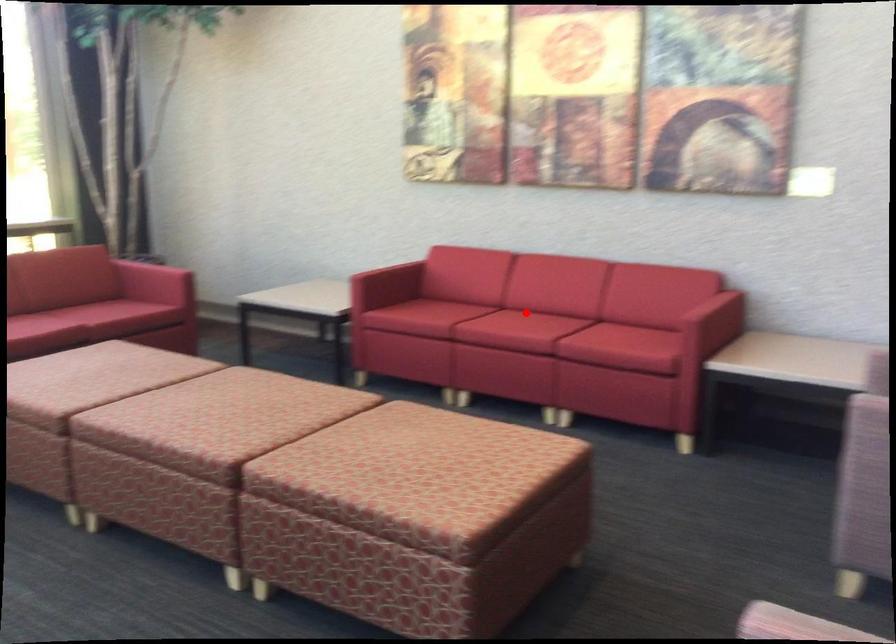
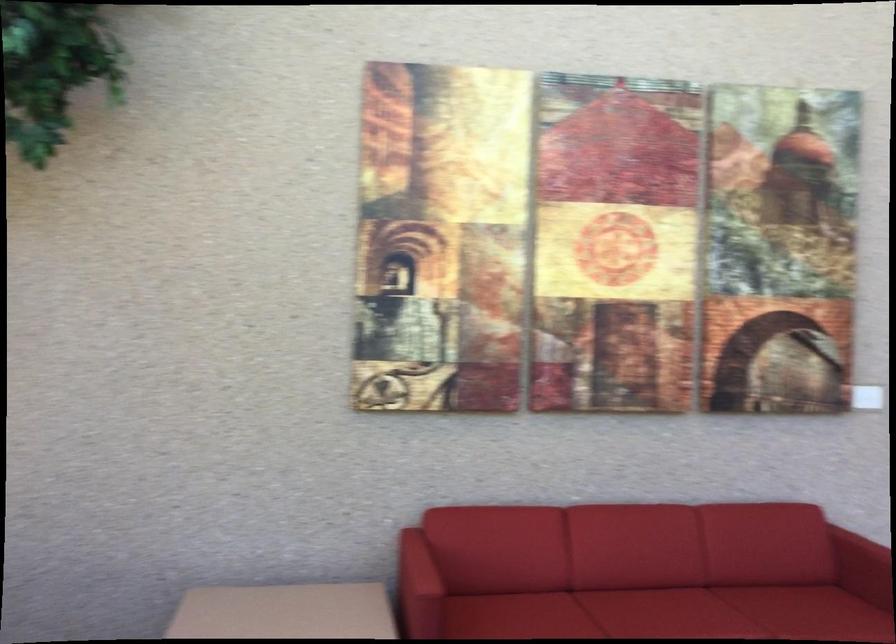
Find the pixel in the second image that matches the highlighted location in the first image.

(659, 607)